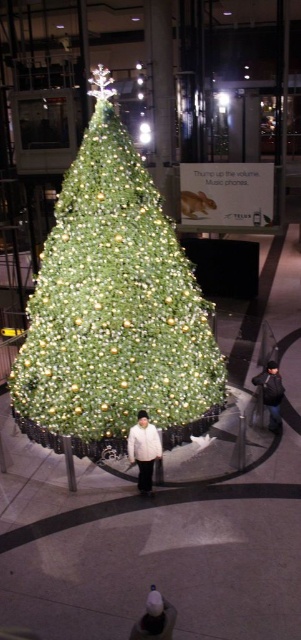
You are a delivery person who needs to place a package between the green matte christmas tree at center and the white knit cap at center. The package requires a space of 3 meters. Is there enough space between them?

The distance between the green matte christmas tree at center and the white knit cap at center is 4.04 meters, so yes, there is enough space to place the package between them since the required space is 3 meters.

You are a store manager at the mall and want to place a new display stand that is 1 meter wide between the white matte jacket at center and the dark gray knit hat at lower right. Based on the scene description, will the display stand fit between them?

The white matte jacket at center is thinner than the dark gray knit hat at lower right. However, the exact distance between them isn not provided in the objects description. Therefore, it is unclear if the 1 meter wide display stand will fit between them.

Consider the image. You are a photographer setting up a tripod to capture the Christmas tree and its decorations. You notice the white matte jacket at center and the dark gray knit hat at lower right in your shot. Based on their sizes, which object should you adjust your focus on to ensure both are in frame without cropping?

The white matte jacket at center has a smaller size compared to dark gray knit hat at lower right. To ensure both are in frame without cropping, adjust focus to include the larger dark gray knit hat at lower right first, then frame the smaller white matte jacket at center within the same shot.